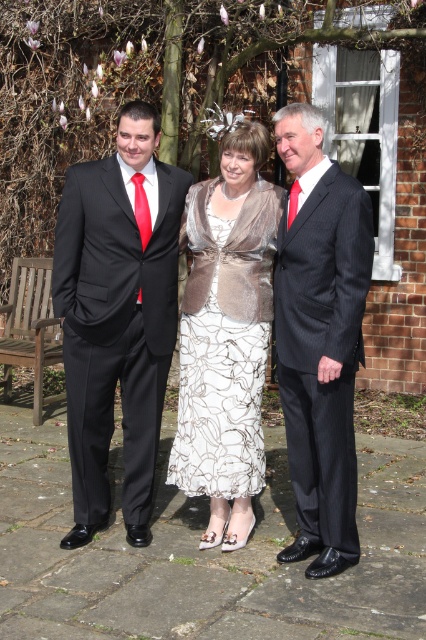
You are a photographer setting up a shoot in the courtyard. You need to ensure that the matte black suit at left and the wooden park bench at left are both visible in the frame. Is the bench currently blocking the view of the suit?

The matte black suit at left is positioned over the wooden park bench at left, so the bench is not blocking the view of the suit.

You are a photographer positioned behind the wooden park bench at left and want to take a photo of the dark gray pinstripe suit at center. Which object is closer to your current position?

The dark gray pinstripe suit at center is closer to the photographer than the wooden park bench at left, so the dark gray pinstripe suit at center is closer to your current position.

You are a photographer trying to capture a group photo of the matte black suit at left and the dark gray pinstripe suit at center. Since you want to ensure that both subjects are clearly visible, you need to know their relative positions. Which one is positioned to the left of the other?

The matte black suit at left is positioned on the left side of dark gray pinstripe suit at center, so the matte black suit at left is to the left of the dark gray pinstripe suit at center.